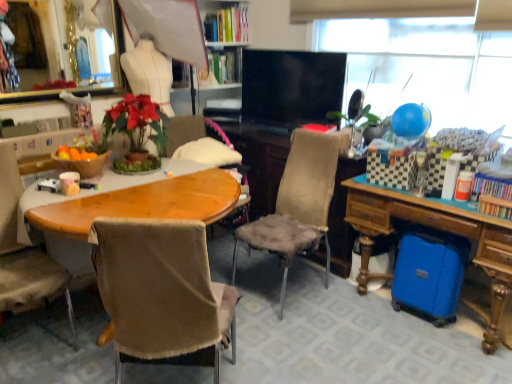
Question: Is black glossy flat-screen tv at center thinner than brown fabric chair at left, which ranks as the third chair in right-to-left order?

Choices:
 (A) yes
 (B) no

Answer: (A)

Question: Does black glossy flat-screen tv at center lie behind brown fabric chair at left, which ranks as the third chair in right-to-left order?

Choices:
 (A) no
 (B) yes

Answer: (B)

Question: Is black glossy flat-screen tv at center outside of brown fabric chair at left, which ranks as the third chair in right-to-left order?

Choices:
 (A) yes
 (B) no

Answer: (A)

Question: From a real-world perspective, is black glossy flat-screen tv at center over brown fabric chair at left, which ranks as the third chair in right-to-left order?

Choices:
 (A) no
 (B) yes

Answer: (B)

Question: Is black glossy flat-screen tv at center smaller than brown fabric chair at left, the first chair viewed from the left?

Choices:
 (A) no
 (B) yes

Answer: (B)

Question: Does black glossy flat-screen tv at center appear on the left side of brown fabric chair at left, which ranks as the third chair in right-to-left order?

Choices:
 (A) no
 (B) yes

Answer: (A)

Question: Considering the relative sizes of brown fabric chair at center and brown fabric chair at center, marked as the 2th chair in a right-to-left arrangement, in the image provided, is brown fabric chair at center bigger than brown fabric chair at center, marked as the 2th chair in a right-to-left arrangement,?

Choices:
 (A) no
 (B) yes

Answer: (A)

Question: Does brown fabric chair at center have a lesser width compared to brown fabric chair at center, the second chair viewed from the left?

Choices:
 (A) no
 (B) yes

Answer: (A)

Question: Could you tell me if brown fabric chair at center is turned towards brown fabric chair at center, marked as the 2th chair in a right-to-left arrangement?

Choices:
 (A) no
 (B) yes

Answer: (A)

Question: Is brown fabric chair at center surrounding brown fabric chair at center, marked as the 2th chair in a right-to-left arrangement?

Choices:
 (A) yes
 (B) no

Answer: (B)

Question: Does brown fabric chair at center have a smaller size compared to brown fabric chair at center, the second chair viewed from the left?

Choices:
 (A) yes
 (B) no

Answer: (A)

Question: Is brown fabric chair at center placed right next to brown fabric chair at center, marked as the 2th chair in a right-to-left arrangement?

Choices:
 (A) yes
 (B) no

Answer: (B)

Question: Can you confirm if blue glossy balloon at upper right is thinner than brown fabric chair at left, the first chair viewed from the left?

Choices:
 (A) yes
 (B) no

Answer: (A)